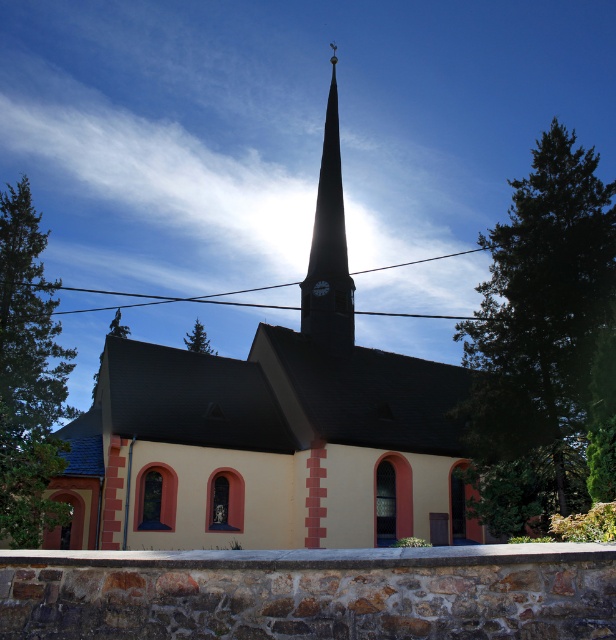
Question: Is smooth gray spire at center to the left of black glass clock at upper center from the viewer's perspective?

Choices:
 (A) yes
 (B) no

Answer: (B)

Question: Which of the following is the farthest from the observer?

Choices:
 (A) yellow matte church at center
 (B) black glass clock at upper center
 (C) smooth gray spire at center

Answer: (B)

Question: Which point is farther from the camera taking this photo?

Choices:
 (A) (298, 461)
 (B) (339, 333)
 (C) (318, 291)

Answer: (C)

Question: Does yellow matte church at center lie behind black glass clock at upper center?

Choices:
 (A) yes
 (B) no

Answer: (B)

Question: Which point is farther to the camera?

Choices:
 (A) smooth gray spire at center
 (B) black glass clock at upper center

Answer: (B)

Question: Does yellow matte church at center appear under smooth gray spire at center?

Choices:
 (A) yes
 (B) no

Answer: (A)